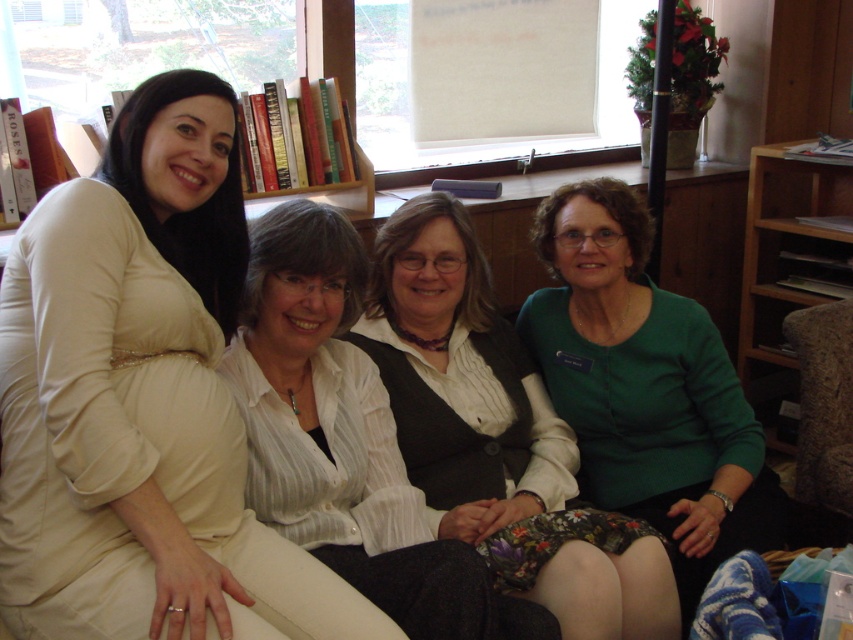
You are a photographer trying to capture both the green matte sweater at center and the green matte sweater at right in a single shot. Which sweater should you focus on first to ensure both are in clear focus?

You should focus on the green matte sweater at center first because it is closer to the viewer, ensuring that both it and the green matte sweater at right will be in focus when using a proper aperture setting.

You are a guest at this gathering and want to place a small notebook on the nearest available surface to your right. The green matte sweater at right and the brown wooden bookshelf at right are both to your right. Which surface should you choose?

The green matte sweater at right is located below the brown wooden bookshelf at right, so the brown wooden bookshelf at right is higher up and likely a better surface for placing the notebook.